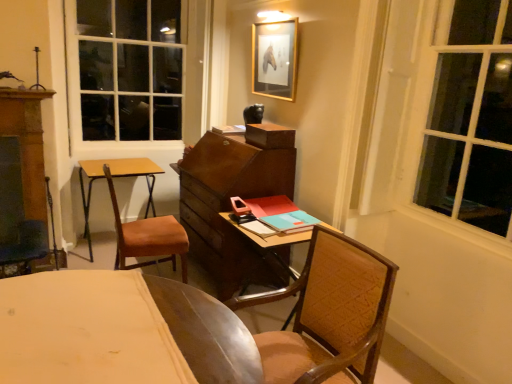
Question: Is brown leather chair at left, positioned as the 2th chair in front-to-back order, bigger or smaller than brown woven chair at center, which appears as the first chair when viewed from the front?

Choices:
 (A) big
 (B) small

Answer: (B)

Question: From their relative heights in the image, would you say brown leather chair at left, the 1th chair from the left, is taller or shorter than brown woven chair at center, which appears as the 2th chair when viewed from the back?

Choices:
 (A) short
 (B) tall

Answer: (B)

Question: Considering the real-world distances, which object is closest to the gold-framed picture at upper center?

Choices:
 (A) brown wooden dresser at left
 (B) wooden desk at center
 (C) brown leather chair at left, positioned as the 2th chair in front-to-back order
 (D) brown woven chair at center, marked as the second chair in a left-to-right arrangement
 (E) wooden round table at left

Answer: (B)

Question: Which object is positioned closest to the brown woven chair at center, which appears as the first chair when viewed from the front?

Choices:
 (A) gold-framed picture at upper center
 (B) brown wooden dresser at left
 (C) wooden round table at left
 (D) brown leather chair at left, positioned as the 2th chair in front-to-back order
 (E) wooden desk at center

Answer: (E)